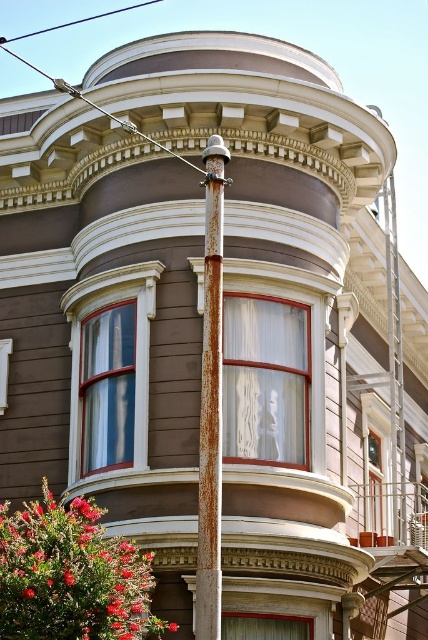
You are standing in front of the Victorian building and want to touch both the rusty metal pole at center and the blue wire at upper center. Which object would you need to reach out further to touch?

The blue wire at upper center is further away from you than the rusty metal pole at center, so you would need to reach out further to touch the blue wire at upper center.

In the scene shown: You are a painter standing in front of the Victorian building. You need to paint both the rusty metal pole at center and the blue wire at upper center. Which object should you paint first if you want to start with the taller one?

The rusty metal pole at center is taller than the blue wire at upper center, so you should paint the rusty metal pole at center first.